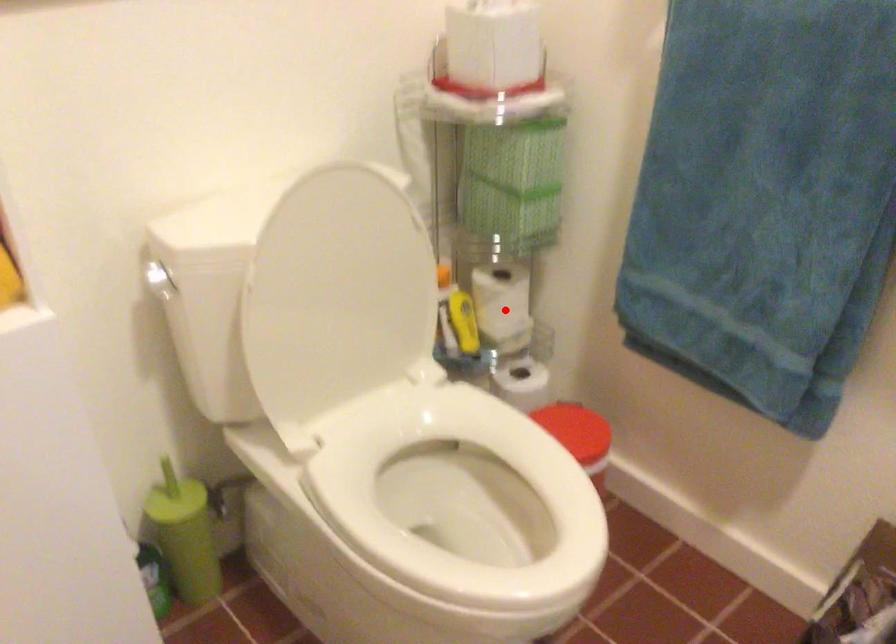
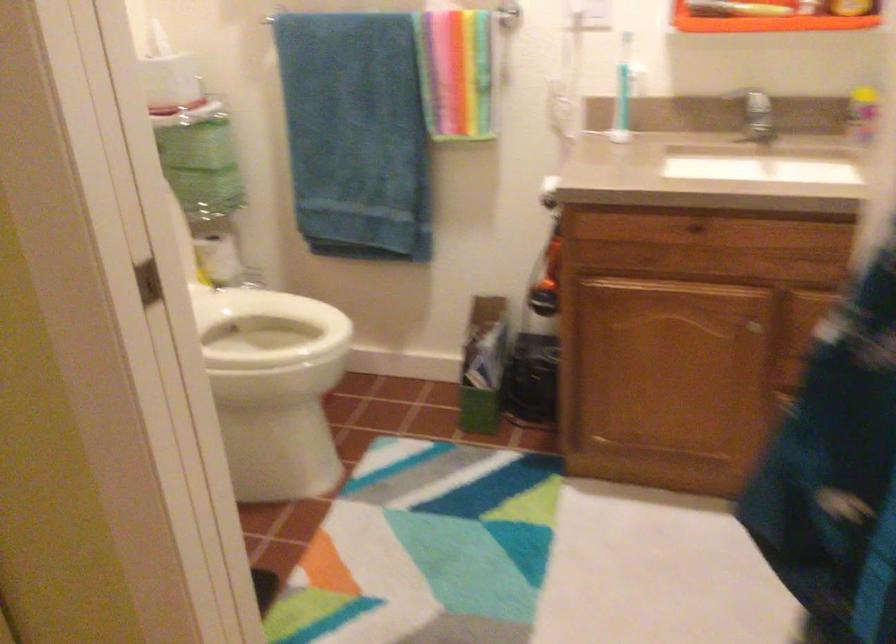
Question: A red point is marked in image1. In image2, is the corresponding 3D point closer to the camera or farther? Reply with the corresponding letter.

Choices:
 (A) The corresponding 3D point is closer.
 (B) The corresponding 3D point is farther.

Answer: (B)